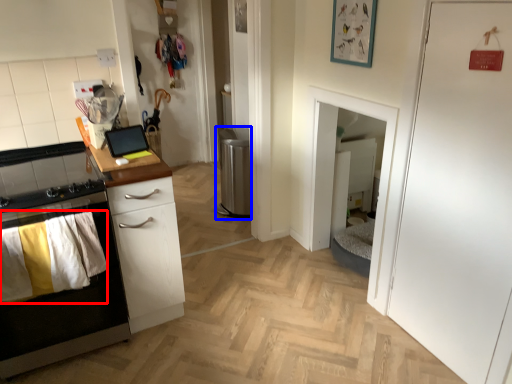
Question: Which of the following is the closest to the observer, laundry (highlighted by a red box) or appliance (highlighted by a blue box)?

Choices:
 (A) laundry
 (B) appliance

Answer: (A)